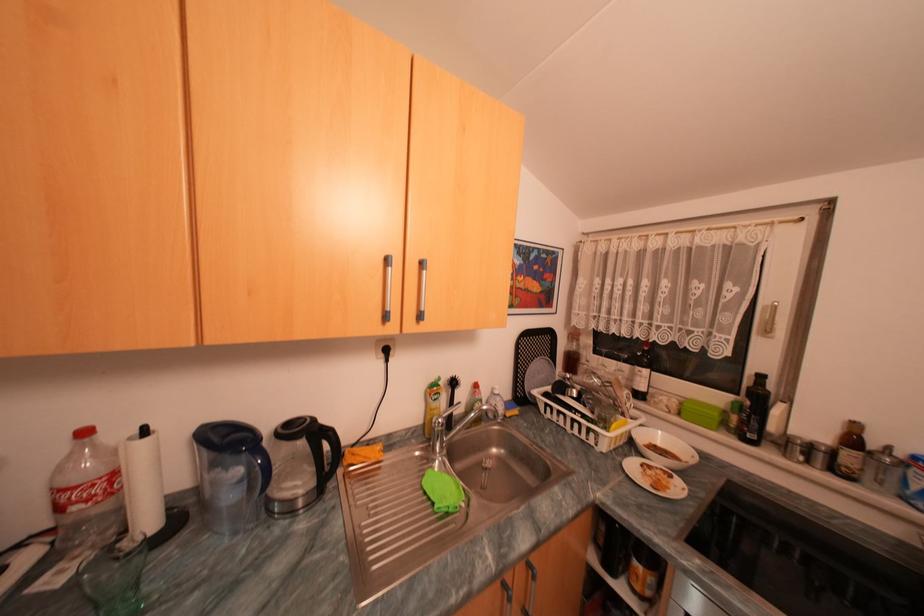
What are the coordinates of `dark glass bottle` in the screenshot? It's located at (755, 411).